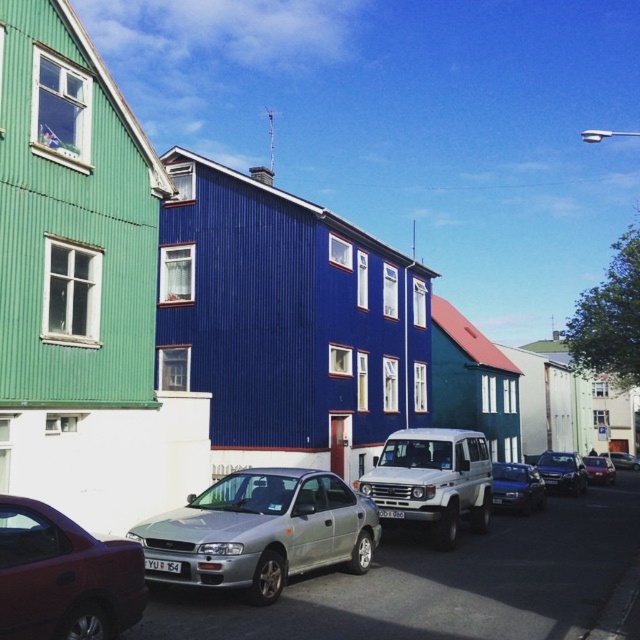
Which is below, silver metallic car at center or shiny red sedan at lower left?

silver metallic car at center is lower down.

Is silver metallic car at center below shiny red sedan at lower left?

Indeed, silver metallic car at center is positioned under shiny red sedan at lower left.

Is point (248, 529) closer to viewer compared to point (22, 586)?

That is False.

You are a GUI agent. You are given a task and a screenshot of the screen. Output one action in this format:
    pyautogui.click(x=<x>, y=<y>)
    Task: Click on the silver metallic car at center
    The image size is (640, 640).
    Given the screenshot: What is the action you would take?
    pyautogui.click(x=260, y=531)

Which of these two, metallic blue sedan at center or metallic silver sedan at center-right, stands shorter?

Standing shorter between the two is metallic blue sedan at center.

Which is behind, point (529, 506) or point (609, 465)?

Point (609, 465)

Image resolution: width=640 pixels, height=640 pixels. In order to click on metallic blue sedan at center in this screenshot , I will do `click(516, 486)`.

Which is below, white matte van at center or metallic blue sedan at center?

Positioned lower is metallic blue sedan at center.

Does white matte van at center have a lesser width compared to metallic blue sedan at center?

In fact, white matte van at center might be wider than metallic blue sedan at center.

Image resolution: width=640 pixels, height=640 pixels. I want to click on white matte van at center, so click(x=433, y=481).